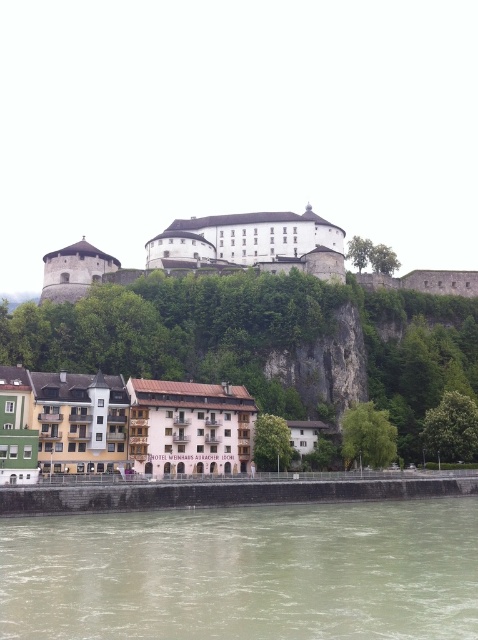
You are a hiker standing at the base of the hill where the fortress is located. You want to reach the fortress by following the path that goes through the brown sedimentary rock at lower center. Is the point marked by point (245,572) on the path towards the fortress?

The point marked by point (245,572) is the brown sedimentary rock at lower center, which is on the path towards the fortress.

You are a tourist standing at the base of the hill looking up at the fortress. You notice the brown sedimentary rock at lower center and the multicolored painted buildings at lower center. Which of these two objects is positioned higher in the scene?

The multicolored painted buildings at lower center are positioned higher than the brown sedimentary rock at lower center because the rock is located below the buildings.